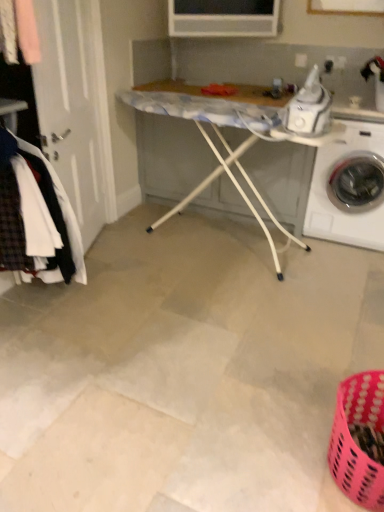
This screenshot has width=384, height=512. Identify the location of plaid wool coat at left. (36, 217).

Describe the element at coordinates (332, 203) in the screenshot. The height and width of the screenshot is (512, 384). I see `white glossy washing machine at right` at that location.

What do you see at coordinates (184, 371) in the screenshot?
I see `white tile floor at center` at bounding box center [184, 371].

Identify the location of plaid wool coat at left. This screenshot has width=384, height=512. (36, 217).

In the scene shown: In terms of width, does white plastic ironing board at center look wider or thinner when compared to white glossy washing machine at right?

white plastic ironing board at center is thinner than white glossy washing machine at right.

Is white plastic ironing board at center taller than white glossy washing machine at right?

Indeed, white plastic ironing board at center has a greater height compared to white glossy washing machine at right.

Consider the image. From a real-world perspective, who is located higher, white plastic ironing board at center or white glossy washing machine at right?

white plastic ironing board at center is physically above.

From the image's perspective, which object appears higher, white plastic ironing board at center or white glossy washing machine at right?

white glossy washing machine at right is shown above in the image.

Measure the distance between white plastic ironing board at center and plaid wool coat at left.

white plastic ironing board at center and plaid wool coat at left are 1.06 meters apart.

Who is taller, white plastic ironing board at center or plaid wool coat at left?

white plastic ironing board at center.

Could you tell me if white plastic ironing board at center is facing plaid wool coat at left?

Yes, white plastic ironing board at center is oriented towards plaid wool coat at left.

Considering the positions of point (277, 111) and point (75, 231), is point (277, 111) closer or farther from the camera than point (75, 231)?

Clearly, point (277, 111) is more distant from the camera than point (75, 231).

Is white plastic ironing board at center positioned behind white tile floor at center?

That is True.

Can you tell me how much white plastic ironing board at center and white tile floor at center differ in facing direction?

The angle between the facing direction of white plastic ironing board at center and the facing direction of white tile floor at center is 4.59 degrees.

Where is `table lying above the white tile floor at center (from the image's perspective)`? table lying above the white tile floor at center (from the image's perspective) is located at coordinates (226, 143).

Considering the relative positions of white tile floor at center and white plastic ironing board at center in the image provided, is white tile floor at center to the right of white plastic ironing board at center from the viewer's perspective?

In fact, white tile floor at center is to the left of white plastic ironing board at center.

From a real-world perspective, between white tile floor at center and white plastic ironing board at center, who is vertically lower?

white tile floor at center, from a real-world perspective.

Would you say white tile floor at center is inside or outside white plastic ironing board at center?

white tile floor at center is not enclosed by white plastic ironing board at center.

From the image's perspective, between white glossy washing machine at right and plaid wool coat at left, who is located below?

From the image's view, plaid wool coat at left is below.

Considering their positions, is white glossy washing machine at right located in front of or behind plaid wool coat at left?

Visually, white glossy washing machine at right is located behind plaid wool coat at left.

From a real-world perspective, is white glossy washing machine at right positioned above or below plaid wool coat at left?

white glossy washing machine at right is situated lower than plaid wool coat at left in the real world.

Is white glossy washing machine at right facing away from plaid wool coat at left?

No, white glossy washing machine at right is not facing away from plaid wool coat at left.

Where is `concrete that appears below the white glossy washing machine at right (from a real-world perspective)`? The width and height of the screenshot is (384, 512). concrete that appears below the white glossy washing machine at right (from a real-world perspective) is located at coordinates (184, 371).

Looking at this image, could white tile floor at center be considered to be inside white glossy washing machine at right?

Definitely not — white tile floor at center is not inside white glossy washing machine at right.

Which is more to the left, white glossy washing machine at right or white tile floor at center?

From the viewer's perspective, white tile floor at center appears more on the left side.

At what (x,y) coordinates should I click in order to perform the action: click on clothing that appears above the white glossy washing machine at right (from a real-world perspective). Please return your answer as a coordinate pair (x, y). This screenshot has width=384, height=512. Looking at the image, I should click on (36, 217).

Do you think plaid wool coat at left is within white glossy washing machine at right, or outside of it?

plaid wool coat at left is not enclosed by white glossy washing machine at right.

Which of these two, plaid wool coat at left or white glossy washing machine at right, is smaller?

Smaller between the two is plaid wool coat at left.

From the image's perspective, which one is positioned lower, plaid wool coat at left or white glossy washing machine at right?

plaid wool coat at left is shown below in the image.

Find the location of `washing machine on the right side of white plastic ironing board at center`. washing machine on the right side of white plastic ironing board at center is located at coordinates (332, 203).

Where is `clothing above the white plastic ironing board at center (from a real-world perspective)`? The width and height of the screenshot is (384, 512). clothing above the white plastic ironing board at center (from a real-world perspective) is located at coordinates (36, 217).

Which object lies further to the anchor point white glossy washing machine at right, white plastic ironing board at center or white tile floor at center?

white tile floor at center lies further to white glossy washing machine at right than the other object.

Considering their positions, is plaid wool coat at left positioned closer to white glossy washing machine at right than white plastic ironing board at center?

Among the two, white plastic ironing board at center is located nearer to white glossy washing machine at right.

Considering their positions, is white tile floor at center positioned further to white plastic ironing board at center than plaid wool coat at left?

The object further to white plastic ironing board at center is plaid wool coat at left.

When comparing their distances from white glossy washing machine at right, does white plastic ironing board at center or plaid wool coat at left seem further?

plaid wool coat at left is positioned further to the anchor white glossy washing machine at right.

From the picture: Looking at the image, which one is located further to white plastic ironing board at center, white glossy washing machine at right or white tile floor at center?

white tile floor at center.

In the scene shown: When comparing their distances from white tile floor at center, does white glossy washing machine at right or plaid wool coat at left seem closer?

The object closer to white tile floor at center is plaid wool coat at left.

Based on the photo, looking at the image, which one is located further to white tile floor at center, white plastic ironing board at center or plaid wool coat at left?

white plastic ironing board at center.

Estimate the real-world distances between objects in this image. Which object is closer to white plastic ironing board at center, white glossy washing machine at right or plaid wool coat at left?

Among the two, white glossy washing machine at right is located nearer to white plastic ironing board at center.

I want to click on clothing between white tile floor at center and white plastic ironing board at center in the front-back direction, so click(x=36, y=217).

The width and height of the screenshot is (384, 512). What are the coordinates of `concrete between plaid wool coat at left and white glossy washing machine at right from left to right` in the screenshot? It's located at (184, 371).

Identify the location of table positioned between white tile floor at center and white glossy washing machine at right from near to far. This screenshot has width=384, height=512. (226, 143).

Where is `table between plaid wool coat at left and white glossy washing machine at right in the horizontal direction`? This screenshot has height=512, width=384. table between plaid wool coat at left and white glossy washing machine at right in the horizontal direction is located at coordinates (226, 143).